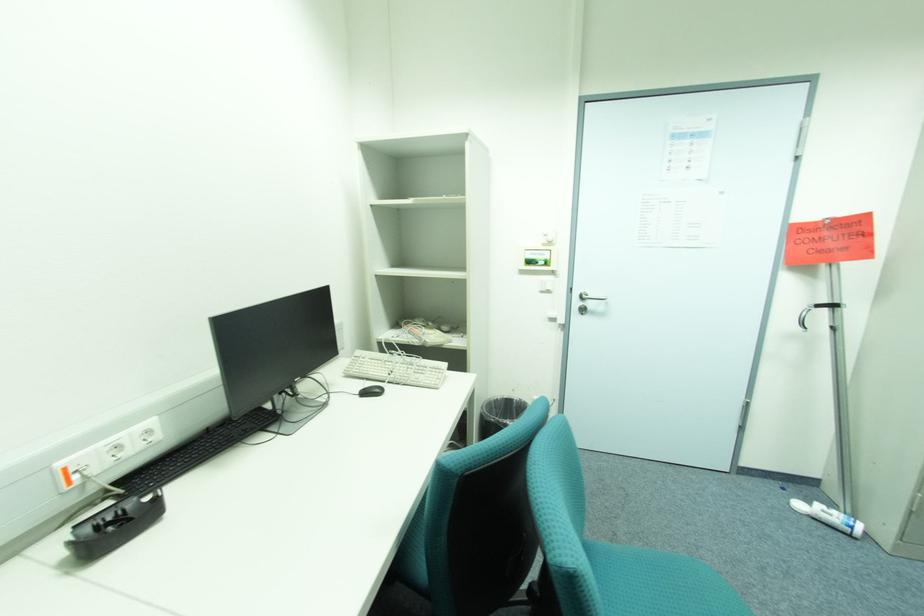
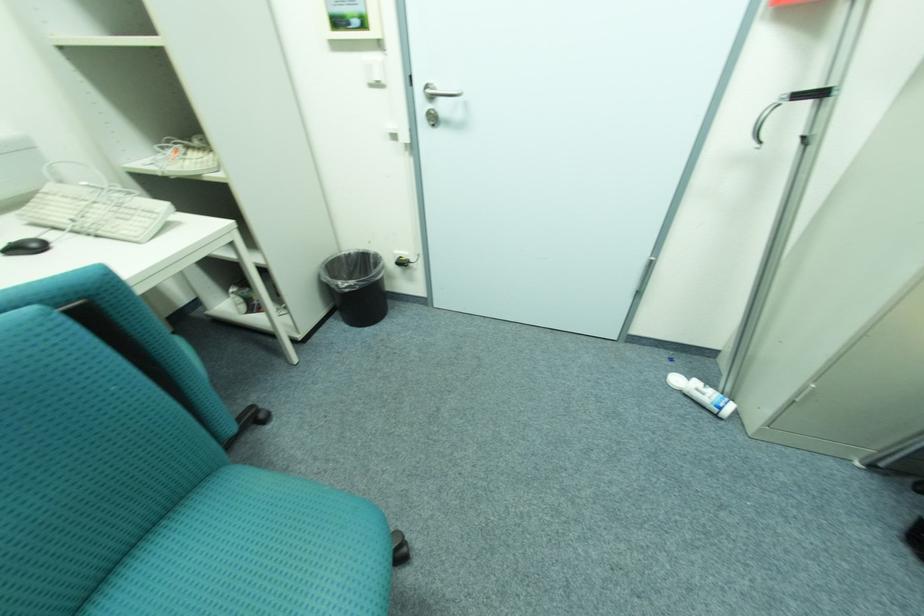
Find the pixel in the second image that matches (394,383) in the first image.

(81, 233)